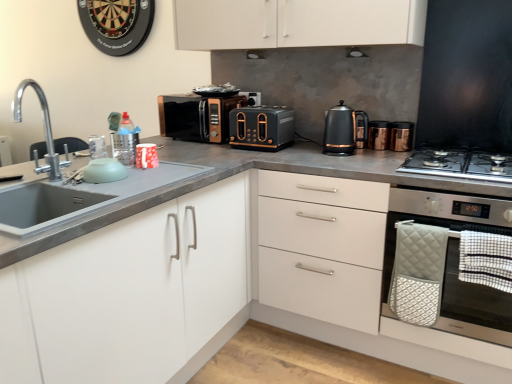
Where is `vacant area that lies to the right of matte green bowl at left, which appears as the fourth appliance when viewed from the back`? The width and height of the screenshot is (512, 384). vacant area that lies to the right of matte green bowl at left, which appears as the fourth appliance when viewed from the back is located at coordinates (145, 174).